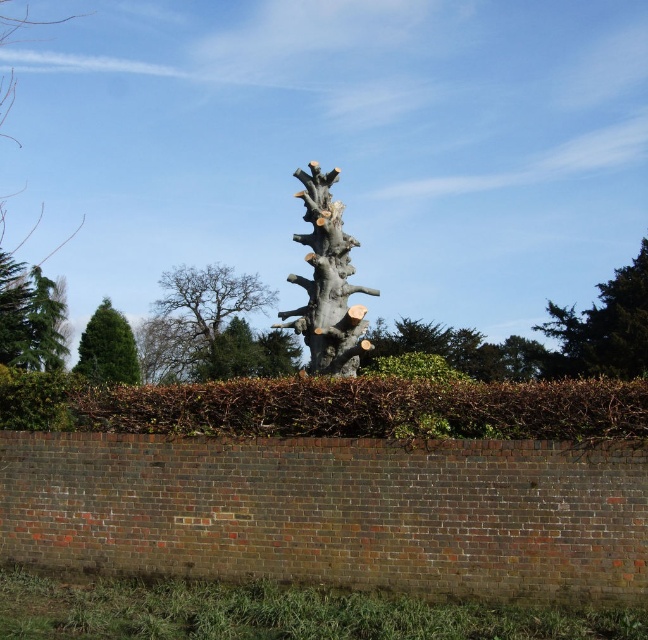
Can you confirm if smooth gray tree trunk at upper center is wider than green needle-like leaves at left?

Yes, smooth gray tree trunk at upper center is wider than green needle-like leaves at left.

Describe the element at coordinates (198, 323) in the screenshot. I see `smooth gray tree trunk at upper center` at that location.

Does point (176, 368) come farther from viewer compared to point (30, 288)?

Yes, it is.

Where is `smooth gray tree trunk at upper center`? This screenshot has height=640, width=648. smooth gray tree trunk at upper center is located at coordinates (198, 323).

Does smooth gray tree trunk at center appear over green textured tree at upper right?

No.

Looking at this image, between smooth gray tree trunk at center and green textured tree at upper right, which one is positioned higher?

green textured tree at upper right is higher up.

I want to click on smooth gray tree trunk at center, so click(x=327, y=282).

Can you confirm if smooth gray tree trunk at center is smaller than green needle-like leaves at left?

Yes.

Does smooth gray tree trunk at center have a greater width compared to green needle-like leaves at left?

No.

This screenshot has width=648, height=640. Identify the location of smooth gray tree trunk at center. (327, 282).